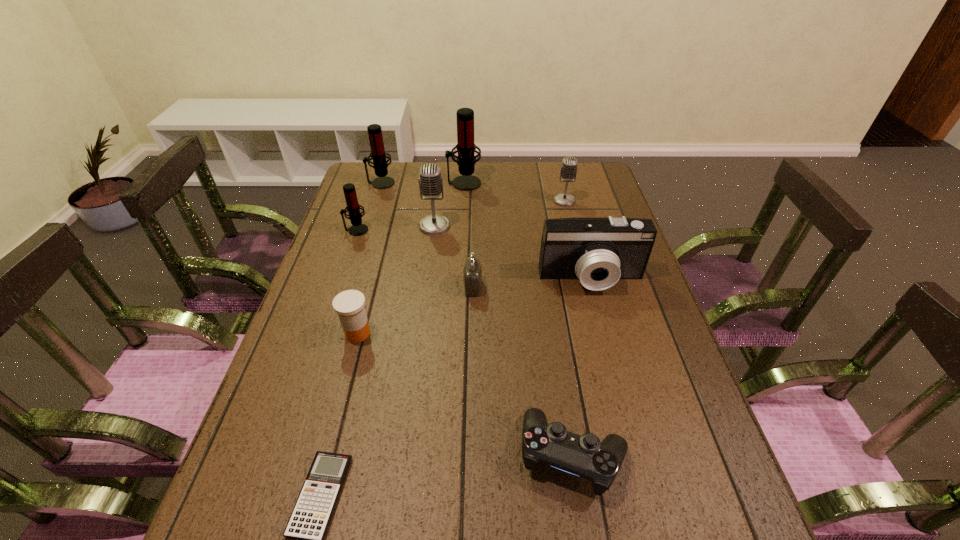
Locate an element on the screen. Image resolution: width=960 pixels, height=540 pixels. vacant area at the right edge of the desktop is located at coordinates (652, 469).

This screenshot has width=960, height=540. Identify the location of free spot at the far right corner of the desktop. (572, 195).

At what (x,y) coordinates should I click in order to perform the action: click on free spot between the ninth tallest object and the second smallest red microphone. Please return your answer as a coordinate pair (x, y). This screenshot has width=960, height=540. Looking at the image, I should click on (476, 319).

I want to click on free space that is in between the eighth nearest object and the second smallest red microphone, so click(472, 192).

Identify the location of empty space between the black camcorder and the rightmost red microphone. (528, 231).

Identify the location of vacant area that lies between the second smallest red microphone and the third nearest object. The height and width of the screenshot is (540, 960). pyautogui.click(x=370, y=258).

This screenshot has width=960, height=540. I want to click on vacant point located between the padlock and the orange medicine, so click(415, 310).

Locate an element on the screen. The width and height of the screenshot is (960, 540). empty space that is in between the eighth farthest object and the tallest object is located at coordinates 411,258.

Locate an element on the screen. object that is the ninth closest to the left gray microphone is located at coordinates (310, 518).

Identify the location of object that is the sixth closest one to the padlock. This screenshot has width=960, height=540. (568, 171).